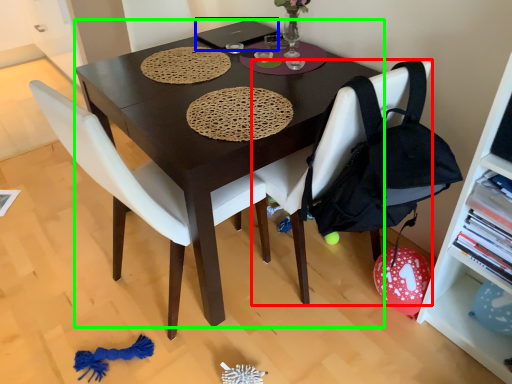
Question: Which is nearer to the chair (highlighted by a red box)? laptop (highlighted by a blue box) or desk (highlighted by a green box).

Choices:
 (A) laptop
 (B) desk

Answer: (B)